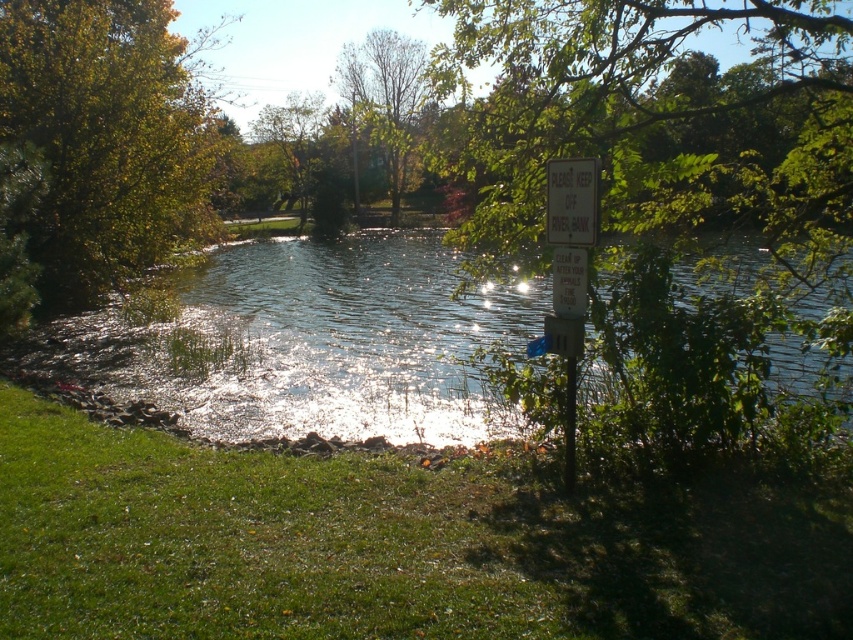
You are standing at the center of the image and want to walk to the green grass at lower left. In which direction should you move?

You should move towards the lower left direction to reach the green grass at lower left.

Looking at this image, you are standing at the riverside and see the green grass at lower left and the white paper sign at upper right. Which object is wider?

The green grass at lower left is wider than the white paper sign at upper right.